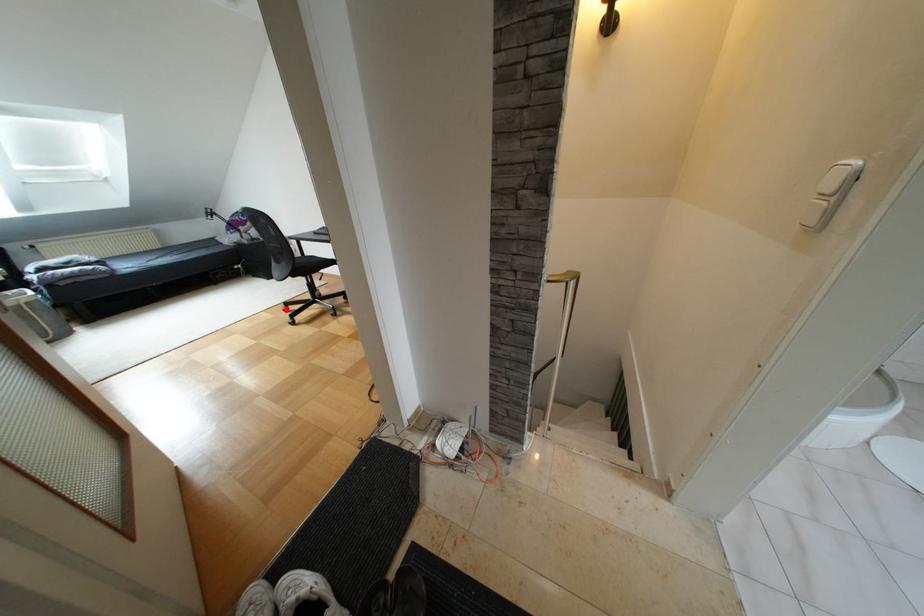
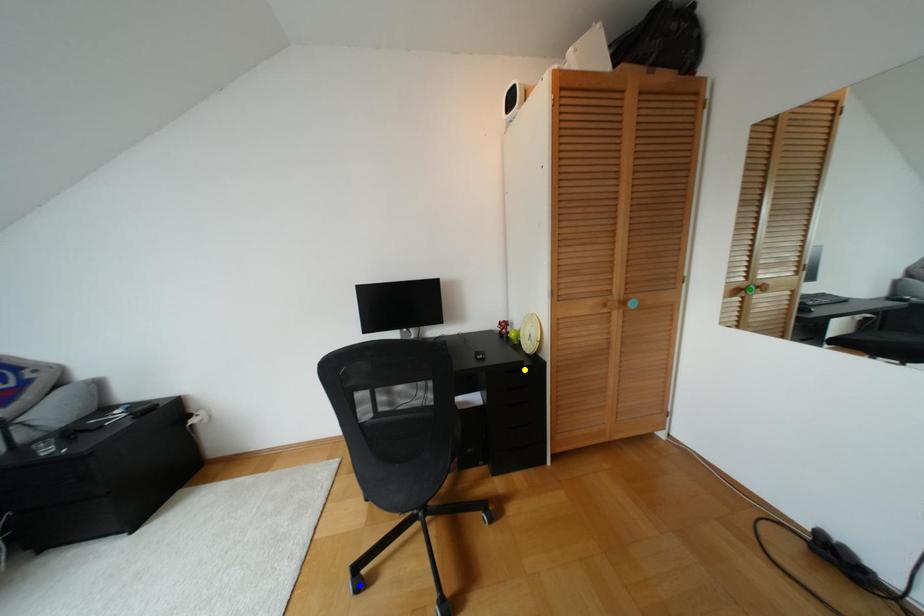
Question: I am providing you with two images of the same scene from different viewpoints. A red point is marked on the first image. You are given multiple points on the second image. Can you choose the point in image 2 that corresponds to the point in image 1?

Choices:
 (A) green point
 (B) blue point
 (C) yellow point

Answer: (B)